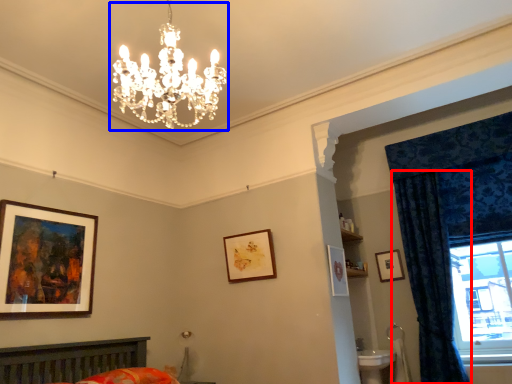
Question: Which point is further to the camera, curtain (highlighted by a red box) or light fixture (highlighted by a blue box)?

Choices:
 (A) curtain
 (B) light fixture

Answer: (A)